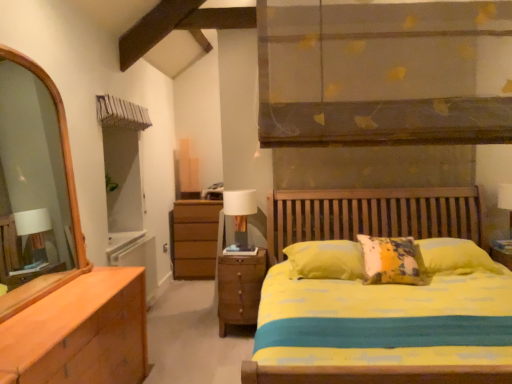
Question: Is white fabric-covered table lamp at center spatially inside wooden nightstand at lower center, or outside of it?

Choices:
 (A) inside
 (B) outside

Answer: (B)

Question: From the image's perspective, is white fabric-covered table lamp at center positioned above or below wooden nightstand at lower center?

Choices:
 (A) below
 (B) above

Answer: (B)

Question: Is point (241, 208) closer or farther from the camera than point (250, 278)?

Choices:
 (A) farther
 (B) closer

Answer: (A)

Question: Considering their positions, is wooden nightstand at lower center located in front of or behind white fabric-covered table lamp at center?

Choices:
 (A) behind
 (B) front

Answer: (B)

Question: From the image's perspective, is wooden nightstand at lower center positioned above or below white fabric-covered table lamp at center?

Choices:
 (A) above
 (B) below

Answer: (B)

Question: Is wooden nightstand at lower center bigger or smaller than white fabric-covered table lamp at center?

Choices:
 (A) big
 (B) small

Answer: (A)

Question: Considering the positions of wooden nightstand at lower center and white fabric-covered table lamp at center in the image, is wooden nightstand at lower center taller or shorter than white fabric-covered table lamp at center?

Choices:
 (A) tall
 (B) short

Answer: (A)